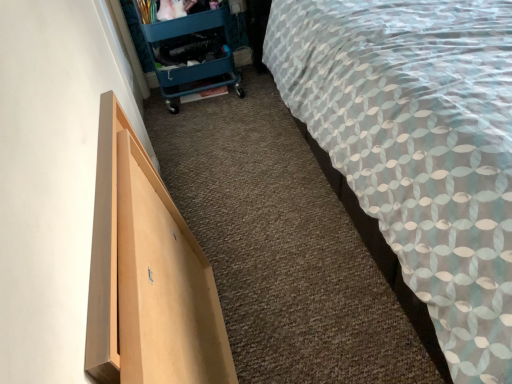
Image resolution: width=512 pixels, height=384 pixels. I want to click on patterned fabric bed at right, so click(418, 147).

At what (x,y) coordinates should I click in order to perform the action: click on teal plastic trolley at upper left. Please return your answer as a coordinate pair (x, y). Looking at the image, I should click on (192, 47).

This screenshot has height=384, width=512. Find the location of `light wood drawer at left`. light wood drawer at left is located at coordinates (147, 275).

Is patterned fabric bed at right to the right of teal plastic trolley at upper left from the viewer's perspective?

Yes.

Is patterned fabric bed at right closer to camera compared to teal plastic trolley at upper left?

Yes, the depth of patterned fabric bed at right is less than that of teal plastic trolley at upper left.

Find the location of a particular element. The width and height of the screenshot is (512, 384). trolley above the patterned fabric bed at right (from the image's perspective) is located at coordinates (192, 47).

Who is bigger, patterned fabric bed at right or teal plastic trolley at upper left?

With larger size is patterned fabric bed at right.

Which object is wider, patterned fabric bed at right or light wood drawer at left?

patterned fabric bed at right is wider.

Is patterned fabric bed at right taller or shorter than light wood drawer at left?

Considering their sizes, patterned fabric bed at right has more height than light wood drawer at left.

Considering the points (404, 130) and (105, 120), which point is behind, point (404, 130) or point (105, 120)?

Positioned behind is point (105, 120).

Is patterned fabric bed at right not close to light wood drawer at left?

No, patterned fabric bed at right is in close proximity to light wood drawer at left.

The height and width of the screenshot is (384, 512). Find the location of `bed above the light wood drawer at left (from a real-world perspective)`. bed above the light wood drawer at left (from a real-world perspective) is located at coordinates (418, 147).

Is light wood drawer at left positioned beyond the bounds of patterned fabric bed at right?

Yes, light wood drawer at left is located beyond the bounds of patterned fabric bed at right.

Is light wood drawer at left next to patterned fabric bed at right?

No, light wood drawer at left is not in contact with patterned fabric bed at right.

Looking at the image, does light wood drawer at left seem bigger or smaller compared to patterned fabric bed at right?

light wood drawer at left is smaller than patterned fabric bed at right.

Considering the relative positions of light wood drawer at left and teal plastic trolley at upper left in the image provided, is light wood drawer at left to the right of teal plastic trolley at upper left from the viewer's perspective?

Yes, light wood drawer at left is to the right of teal plastic trolley at upper left.

From a real-world perspective, is light wood drawer at left located beneath teal plastic trolley at upper left?

Yes, from a real-world perspective, light wood drawer at left is beneath teal plastic trolley at upper left.

Is teal plastic trolley at upper left surrounded by light wood drawer at left?

No.

Which point is more distant from viewer, [173,225] or [180,90]?

Point [180,90]

From the image's perspective, between teal plastic trolley at upper left and light wood drawer at left, who is located below?

light wood drawer at left is shown below in the image.

Considering the positions of objects teal plastic trolley at upper left and light wood drawer at left in the image provided, who is in front, teal plastic trolley at upper left or light wood drawer at left?

light wood drawer at left.

Which is in front, point (224, 19) or point (176, 341)?

Point (176, 341)

From a real-world perspective, does teal plastic trolley at upper left stand above light wood drawer at left?

Indeed, from a real-world perspective, teal plastic trolley at upper left stands above light wood drawer at left.

Is teal plastic trolley at upper left positioned behind patterned fabric bed at right?

Yes, teal plastic trolley at upper left is further from the viewer.

Is teal plastic trolley at upper left oriented towards patterned fabric bed at right?

No, teal plastic trolley at upper left is not oriented towards patterned fabric bed at right.

Is teal plastic trolley at upper left shorter than patterned fabric bed at right?

Yes.

From a real-world perspective, which object stands above the other?

patterned fabric bed at right, from a real-world perspective.

Locate an element on the screen. The image size is (512, 384). bed to the right of teal plastic trolley at upper left is located at coordinates (418, 147).

You are a GUI agent. You are given a task and a screenshot of the screen. Output one action in this format:
    pyautogui.click(x=<x>, y=<y>)
    Task: Click on the bed that appears above the light wood drawer at left (from the image's perspective)
    
    Given the screenshot: What is the action you would take?
    pyautogui.click(x=418, y=147)

Consider the image. Based on their spatial positions, is teal plastic trolley at upper left or light wood drawer at left further from patterned fabric bed at right?

teal plastic trolley at upper left is positioned further to the anchor patterned fabric bed at right.

From the image, which object appears to be farther from light wood drawer at left, teal plastic trolley at upper left or patterned fabric bed at right?

teal plastic trolley at upper left is further to light wood drawer at left.

From the image, which object appears to be nearer to light wood drawer at left, patterned fabric bed at right or teal plastic trolley at upper left?

Based on the image, patterned fabric bed at right appears to be nearer to light wood drawer at left.

Looking at the image, which one is located closer to patterned fabric bed at right, light wood drawer at left or teal plastic trolley at upper left?

The object closer to patterned fabric bed at right is light wood drawer at left.

Based on their spatial positions, is patterned fabric bed at right or light wood drawer at left closer to teal plastic trolley at upper left?

patterned fabric bed at right is positioned closer to the anchor teal plastic trolley at upper left.

Based on their spatial positions, is light wood drawer at left or patterned fabric bed at right further from teal plastic trolley at upper left?

Among the two, light wood drawer at left is located further to teal plastic trolley at upper left.

The image size is (512, 384). What are the coordinates of `furniture between patterned fabric bed at right and teal plastic trolley at upper left in the front-back direction` in the screenshot? It's located at (147, 275).